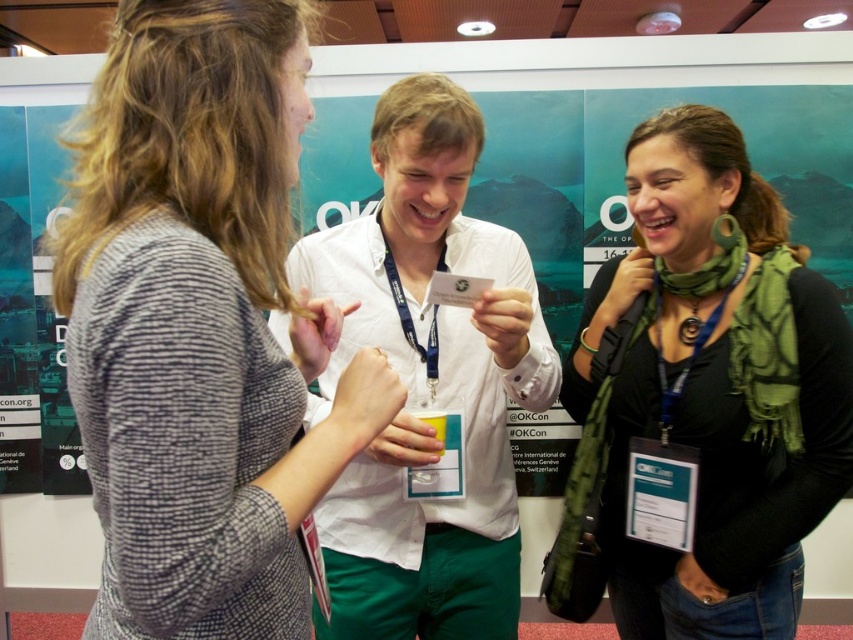
Is knitted gray sweater at left bigger than green fabric scarf at center?

Actually, knitted gray sweater at left might be smaller than green fabric scarf at center.

Who is more distant from viewer, (231, 291) or (659, 381)?

The point (659, 381) is more distant.

What are the coordinates of `knitted gray sweater at left` in the screenshot? It's located at tap(200, 324).